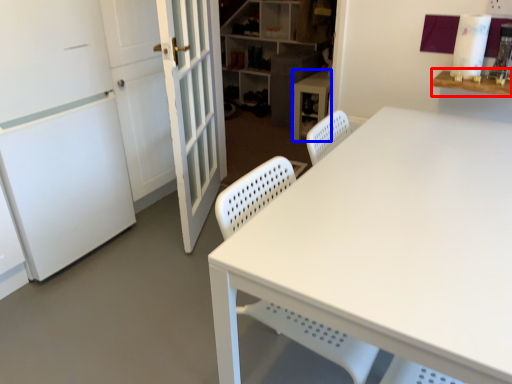
Question: Which object is closer to the camera taking this photo, table (highlighted by a red box) or computer desk (highlighted by a blue box)?

Choices:
 (A) table
 (B) computer desk

Answer: (A)